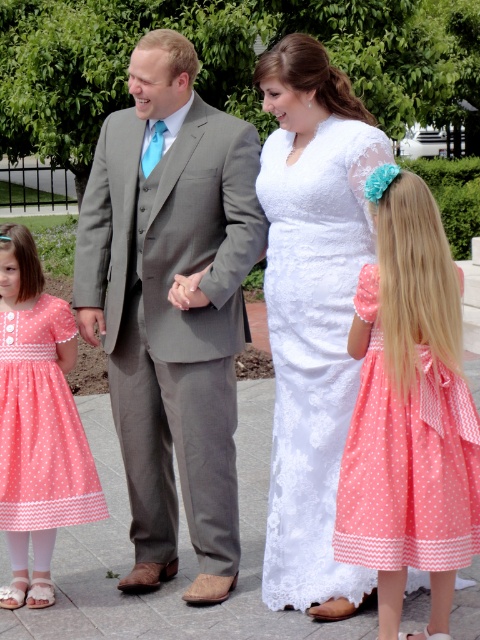
Is matte gray suit at center in front of coral polka dot dress at lower left?

No, it is behind coral polka dot dress at lower left.

From the picture: Which is more to the left, matte gray suit at center or coral polka dot dress at lower left?

coral polka dot dress at lower left

Is point (156, 90) farther from camera compared to point (23, 352)?

No, (156, 90) is in front of (23, 352).

Identify the location of matte gray suit at center. (171, 305).

Does point (469, 545) come closer to viewer compared to point (84, 509)?

Yes.

Which is in front, point (420, 449) or point (59, 368)?

Point (420, 449) is in front.

Is point (369, 196) behind point (57, 524)?

No.

The height and width of the screenshot is (640, 480). I want to click on coral polka dot dress at lower right, so click(x=408, y=412).

Is point (429, 445) closer to camera compared to point (288, 362)?

Yes, it is in front of point (288, 362).

Is coral polka dot dress at lower right thinner than white lace dress at center?

Correct, coral polka dot dress at lower right's width is less than white lace dress at center's.

Does point (439, 227) lie in front of point (305, 472)?

Yes, point (439, 227) is in front of point (305, 472).

Find the location of a particular element. coral polka dot dress at lower right is located at coordinates (408, 412).